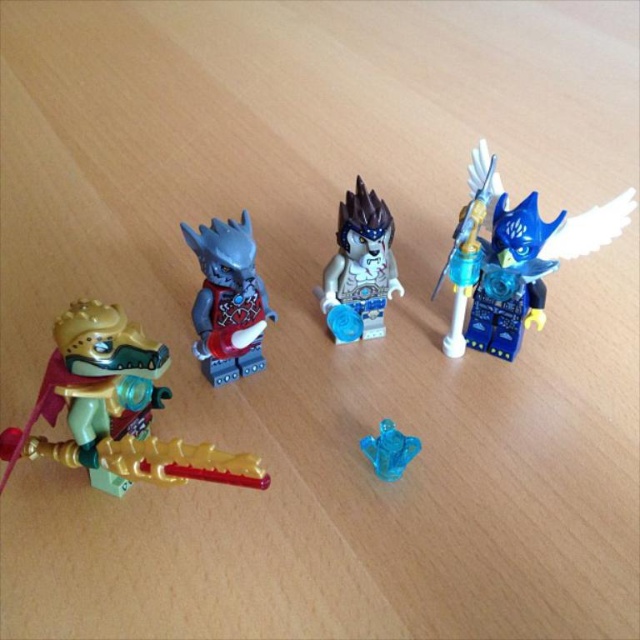
Question: Which of the following is the closest to the observer?

Choices:
 (A) blue translucent figure at upper right
 (B) transparent blue gemstone at center

Answer: (B)

Question: Is gold metallic dragon at lower left above white glossy minifigure at center?

Choices:
 (A) yes
 (B) no

Answer: (B)

Question: Among these objects, which one is farthest from the camera?

Choices:
 (A) blue translucent figure at upper right
 (B) transparent blue gemstone at center
 (C) gold metallic dragon at lower left

Answer: (A)

Question: Can you confirm if gold metallic dragon at lower left is positioned to the right of white glossy minifigure at center?

Choices:
 (A) yes
 (B) no

Answer: (B)

Question: Does blue translucent figure at upper right appear over matte gray minifigure at center?

Choices:
 (A) no
 (B) yes

Answer: (B)

Question: Which point appears closest to the camera in this image?

Choices:
 (A) (381, 257)
 (B) (404, 449)

Answer: (B)